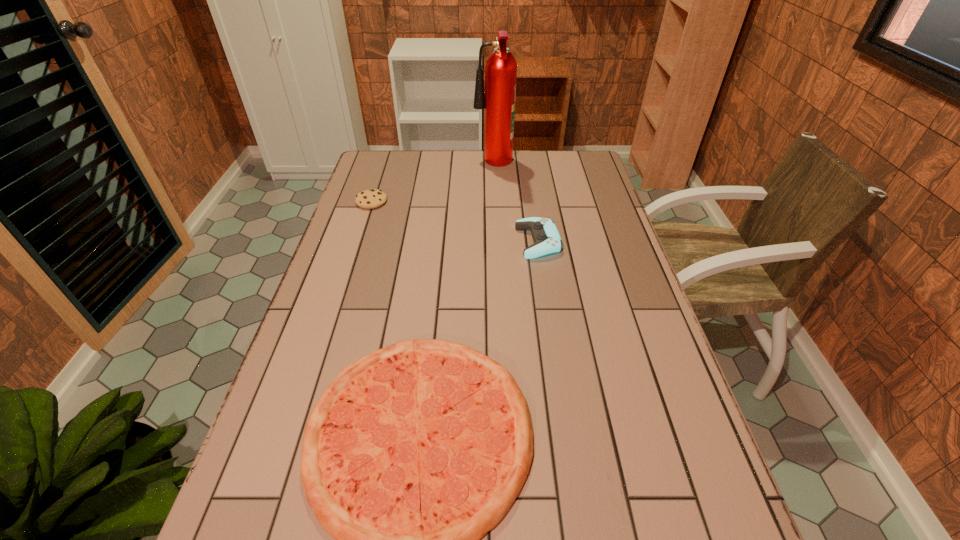
Find the location of a particular element. The height and width of the screenshot is (540, 960). the tallest object is located at coordinates (498, 98).

Where is `fire extinguisher`? The image size is (960, 540). fire extinguisher is located at coordinates (498, 98).

Locate an element on the screen. The height and width of the screenshot is (540, 960). the second nearest object is located at coordinates (547, 240).

Where is `control`? control is located at coordinates pyautogui.click(x=547, y=240).

Identify the location of the third nearest object. This screenshot has height=540, width=960. (372, 198).

What are the coordinates of `vacant space located 0.330m at the nozzle of the tallest object` in the screenshot? It's located at (389, 165).

The width and height of the screenshot is (960, 540). Identify the location of free point located 0.340m at the nozzle of the tallest object. (386, 165).

This screenshot has width=960, height=540. Identify the location of vacant space situated at the nozzle of the tallest object. pyautogui.click(x=427, y=165).

What are the coordinates of `vacant area situated on the front of the second nearest object` in the screenshot? It's located at [550, 321].

At what (x,y) coordinates should I click in order to perform the action: click on vacant space situated on the right of the cookie. Please return your answer as a coordinate pair (x, y). This screenshot has height=540, width=960. Looking at the image, I should click on (476, 201).